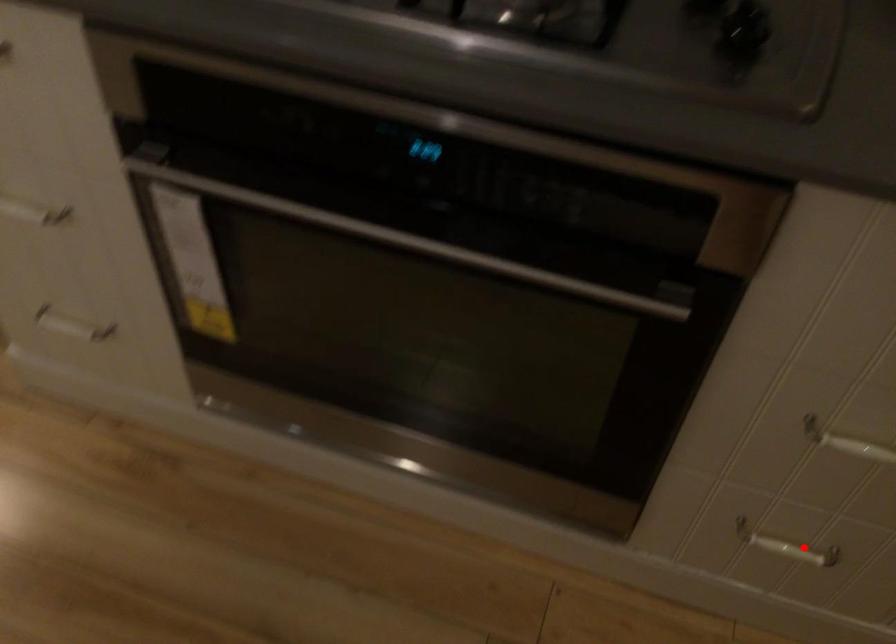
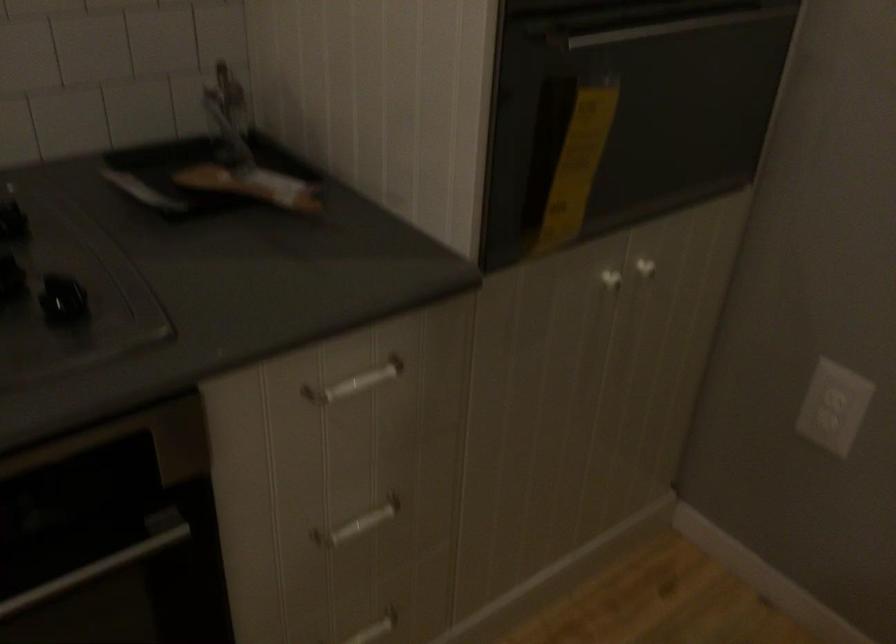
Question: I am providing you with two images of the same scene from different viewpoints. Image1 has a red point marked. In image2, the corresponding 3D location appears at what relative position? Reply with the corresponding letter.

Choices:
 (A) Closer
 (B) Farther

Answer: (B)